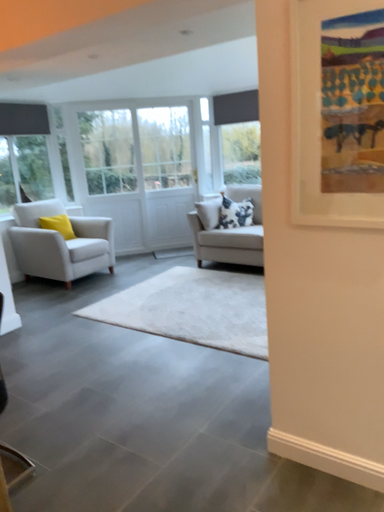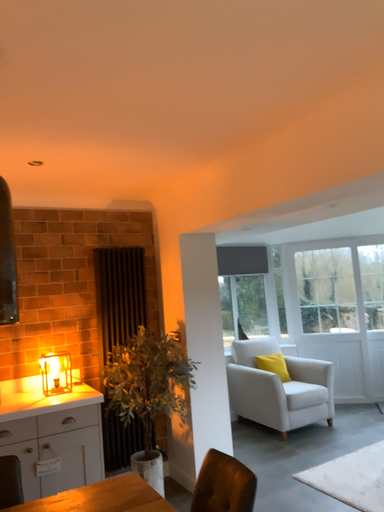
Question: How did the camera likely rotate when shooting the video?

Choices:
 (A) rotated left
 (B) rotated right

Answer: (A)